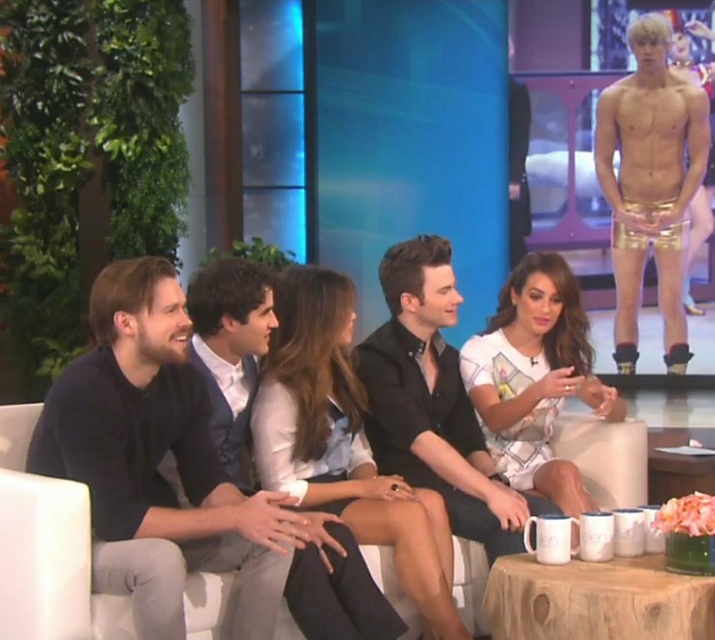
You are a photographer positioned at the origin point of the image. You want to zoom in on the black satin shirt at center. What are the coordinates where you should aim your camera?

The black satin shirt at center is located at point coordinates of (433, 401).

You are a photographer setting up for a group photo in the talk show scene. You need to position a light source above the white printed dress at center to highlight it. Is the white fabric couch at center in a position that might block the light from reaching the dress?

The white fabric couch at center is below the white printed dress at center, so it will block the light from reaching the dress if placed directly above.

You are standing in the talk show studio and want to place a microphone exactly at point (415, 353). The microphone has a 3.5 meter cable. Will the cable be long enough to reach the microphone from your current position?

The distance of point (415, 353) from camera is 3.17 meters, so the microphone cable is 3.5 meters long which is longer than the required distance. The cable will be long enough to reach the microphone from your current position.